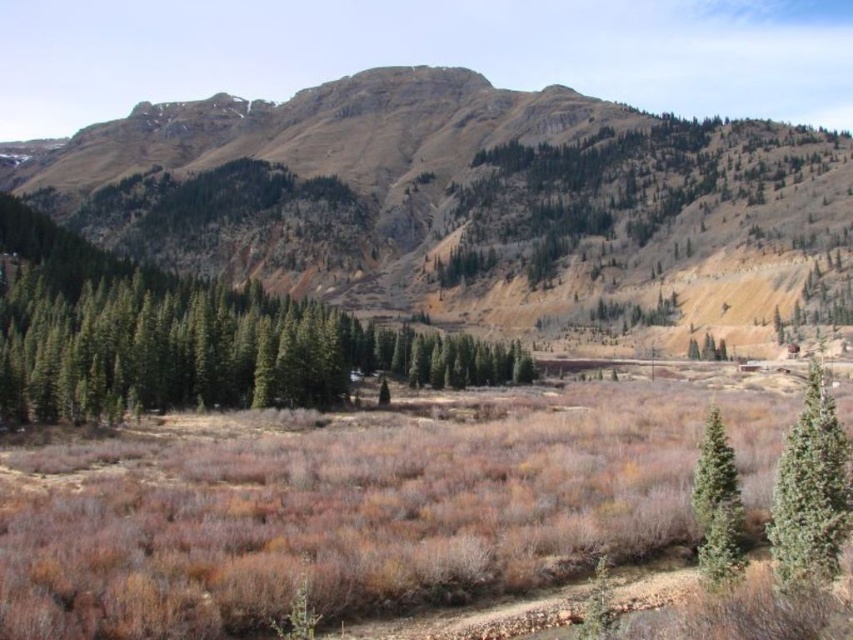
Based on the scene description, where is the brown rocky mountain at center located in terms of coordinates?

The brown rocky mountain at center is located at coordinates point (463, 198).

You are planning to hike up the brown rocky mountain at center and want to know if the green matte tree at left is taller than the mountain. Based on the scene, what can you conclude?

The brown rocky mountain at center has a greater height compared to the green matte tree at left, so the mountain is taller than the tree.